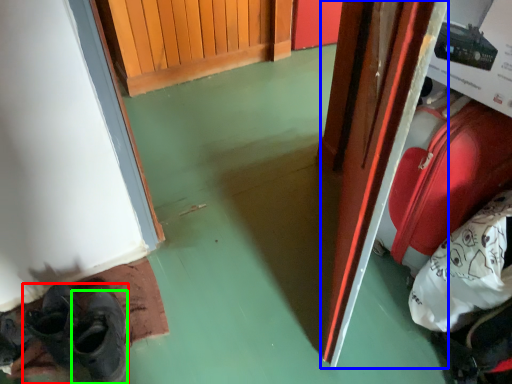
Question: Considering the real-world distances, which object is closest to footwear (highlighted by a red box)? door (highlighted by a blue box) or shoe (highlighted by a green box).

Choices:
 (A) door
 (B) shoe

Answer: (B)